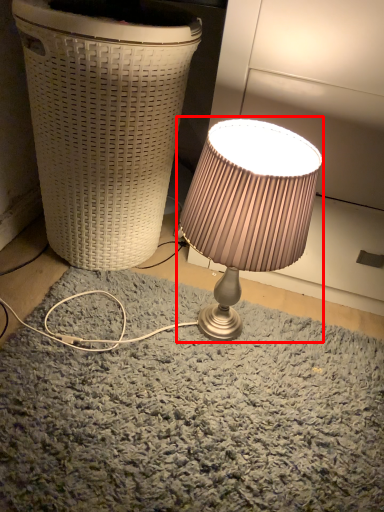
Question: From the image's perspective, what is the correct spatial relationship of lamp (annotated by the red box) in relation to waste container?

Choices:
 (A) above
 (B) below

Answer: (B)